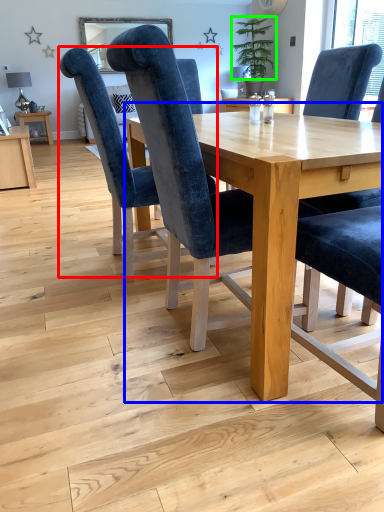
Question: Considering the real-world distances, which object is closest to chair (highlighted by a red box)? table (highlighted by a blue box) or plant (highlighted by a green box).

Choices:
 (A) table
 (B) plant

Answer: (A)